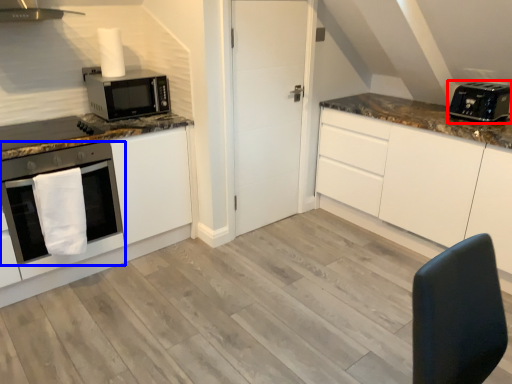
Question: Which of the following is the farthest to the observer, toaster (highlighted by a red box) or oven (highlighted by a blue box)?

Choices:
 (A) toaster
 (B) oven

Answer: (A)